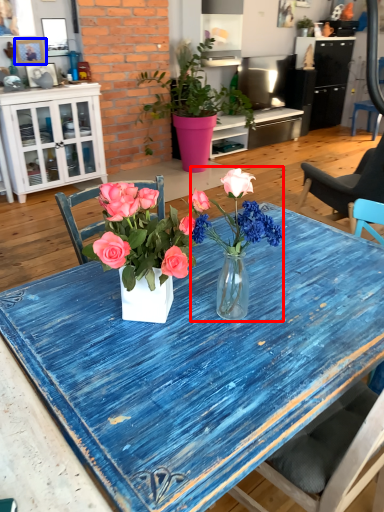
Question: Which point is further to the camera, carnation (highlighted by a red box) or picture frame (highlighted by a blue box)?

Choices:
 (A) carnation
 (B) picture frame

Answer: (B)